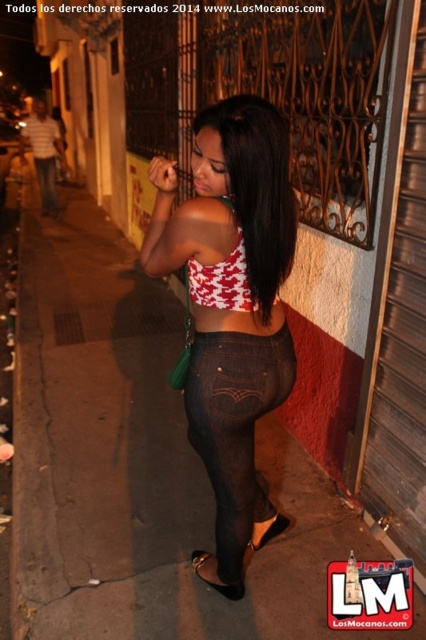
You are a photographer standing in the same spot as the woman in the image. You want to take a photo of the matte red and white top at center without moving closer. Can you capture the entire top in your photo if your camera has a standard 50mm lens?

The matte red and white top at center is 1.26 meters from the viewer. A standard 50mm lens has a field of view wide enough to capture objects at that distance, so yes, you can capture the entire top without moving closer.

You are a photographer trying to capture a detailed shot of the two points in the scene. Which point, point [224,547] or point [273,525], should you focus on to ensure it appears clearer in the photo?

Point [224,547] is closer to the camera than point [273,525], so focusing on it will result in a clearer image.

You are a fashion designer observing the woman in the nighttime scene. You need to determine which item of clothing has a greater width between the jeans at left and the black patent leather sandal at lower center. Which one is wider?

The jeans at left has a greater width than the black patent leather sandal at lower center according to the description.